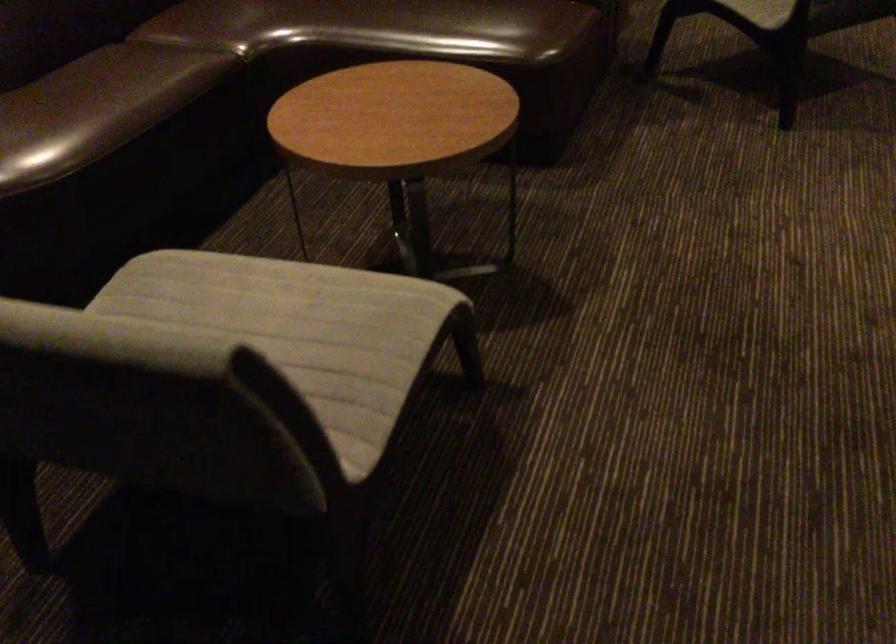
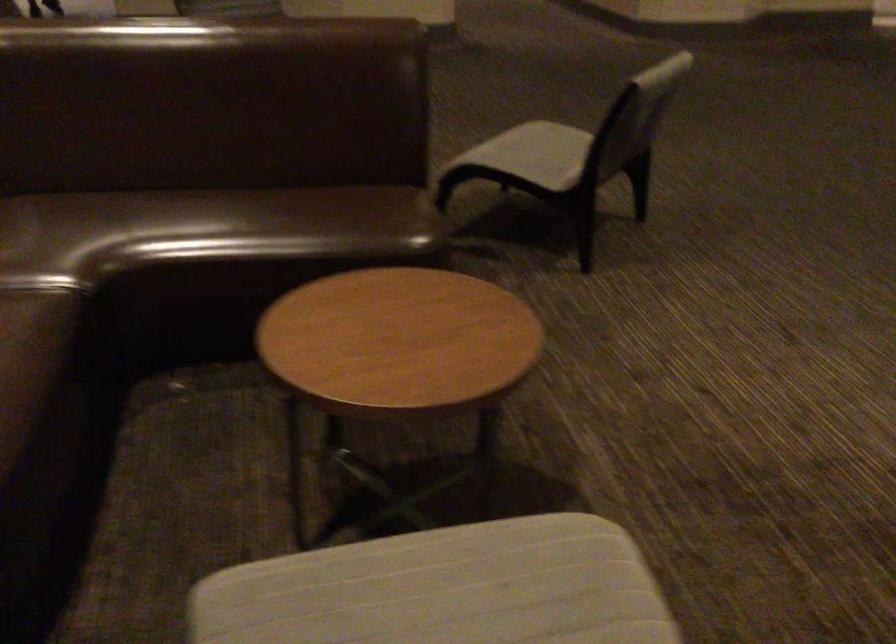
Question: The camera is either moving clockwise (left) or counter-clockwise (right) around the object. The first image is from the beginning of the video and the second image is from the end. Is the camera moving left or right when shooting the video?

Choices:
 (A) Left
 (B) Right

Answer: (A)